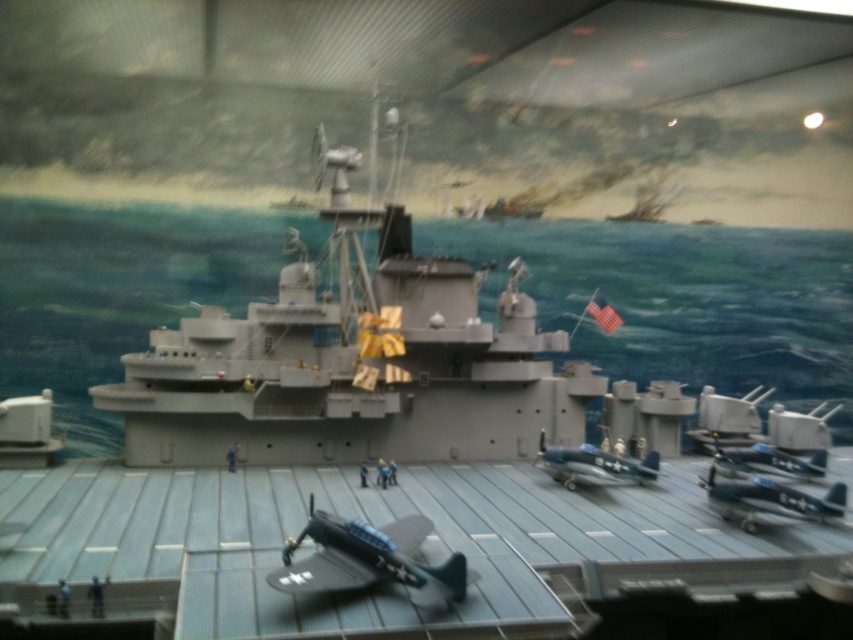
You are a museum visitor looking at the naval diorama. You notice two blue metallic airplanes in the center. Which airplane is closer to you, the metallic blue airplane at center or the blue metallic airplane at center?

Result: The metallic blue airplane at center is closer to you because it is positioned in front of the blue metallic airplane at center in the diorama.

You are a museum visitor standing in front of the naval diorama. You notice a point marked at coordinates (370,560) on the display. What object is located at that specific coordinate?

The point at coordinates (370,560) corresponds to the matte black airplane at center.